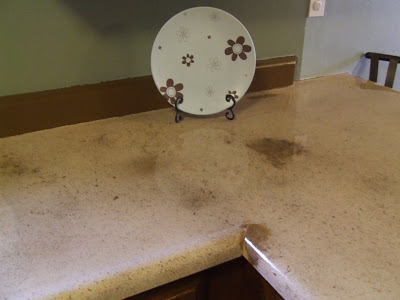
This screenshot has width=400, height=300. In order to click on plate in this screenshot , I will do [203, 71].